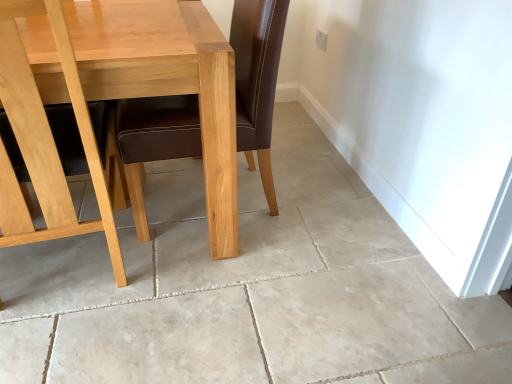
Identify the location of free spot to the right of light brown wood chair at left. (201, 296).